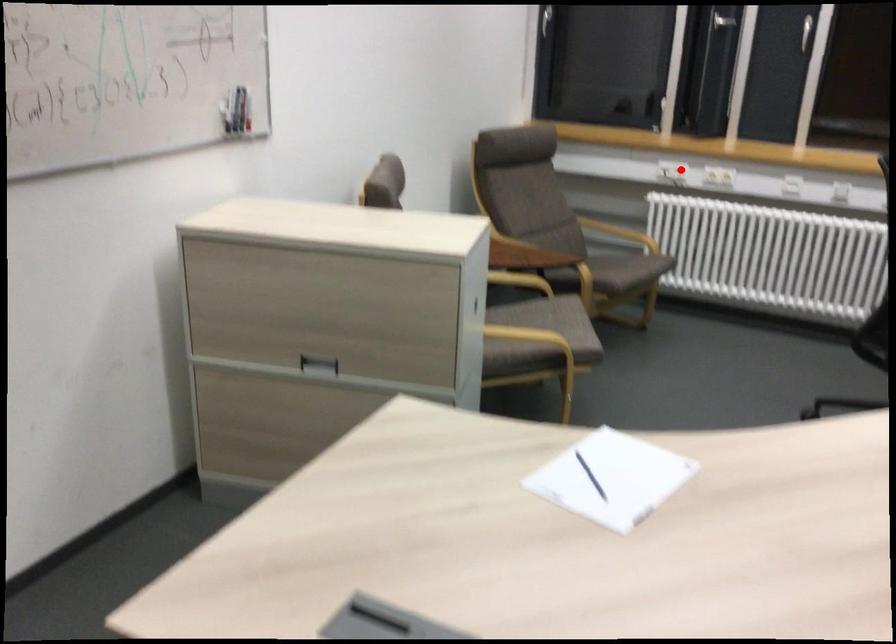
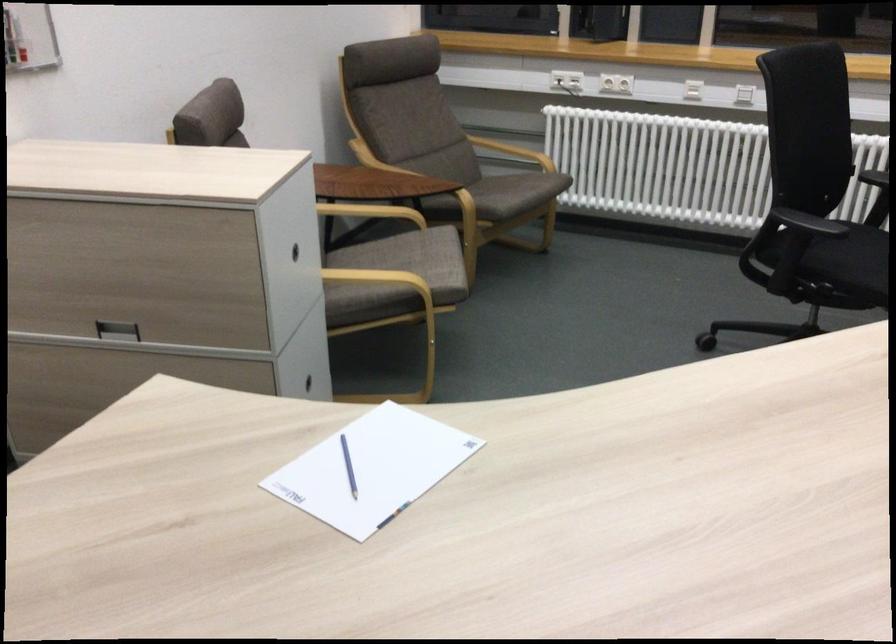
Question: I am providing you with two images of the same scene from different viewpoints. A red point is marked on the first image. Is the red point's position out of view in image 2?

Choices:
 (A) Yes
 (B) No

Answer: (B)